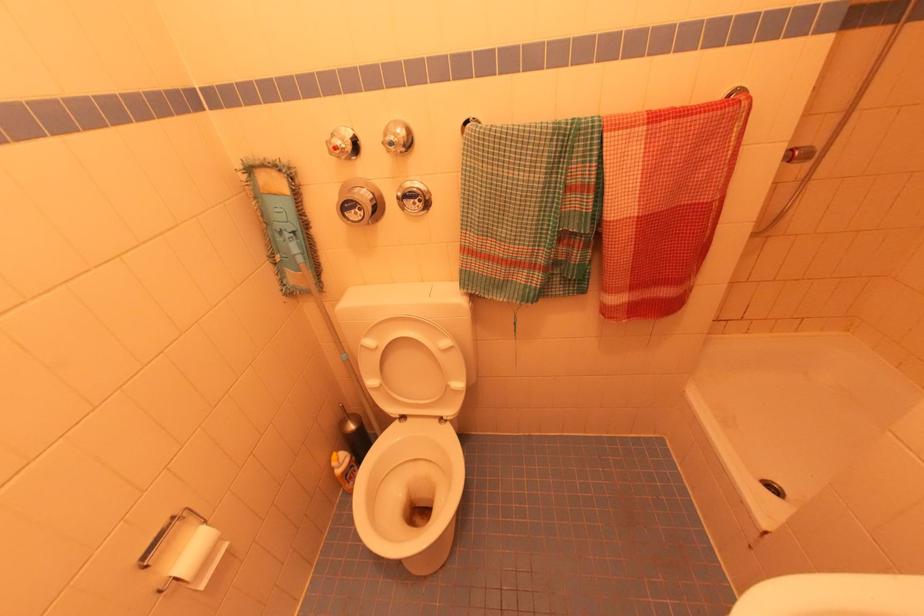
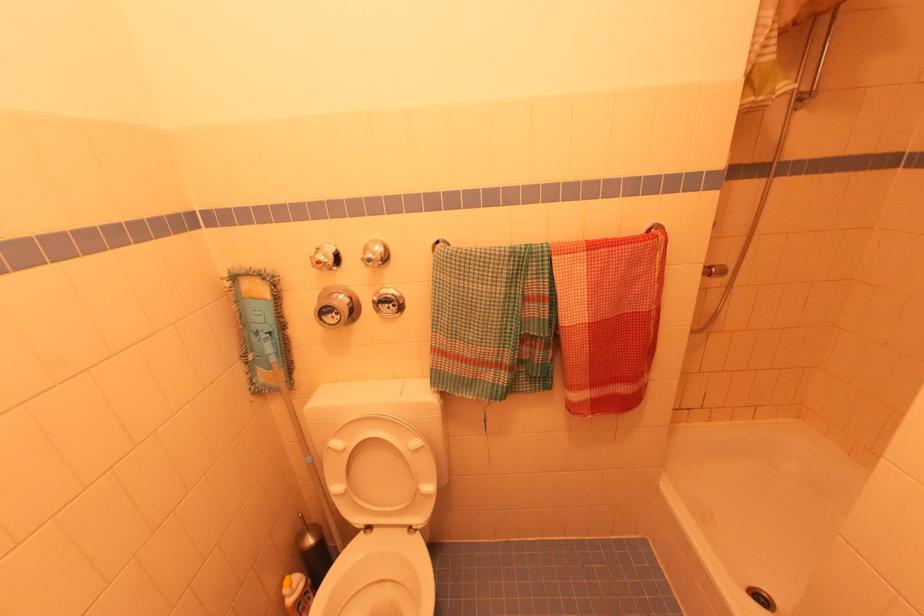
Find the pixel in the second image that matches (320,262) in the first image.

(293, 361)